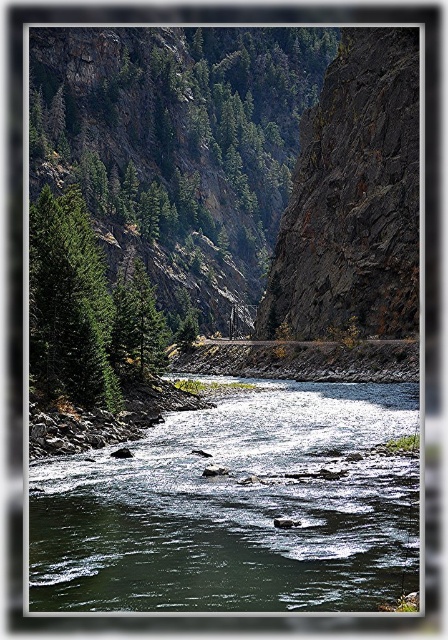
Can you confirm if green smooth water at center is positioned below green matte tree at center-left?

Yes.

Which is more to the right, green smooth water at center or green matte tree at center-left?

From the viewer's perspective, green smooth water at center appears more on the right side.

Find the location of a particular element. The image size is (448, 640). green smooth water at center is located at coordinates point(236,508).

Based on the photo, can you confirm if green matte tree at left is positioned above green matte tree at center-left?

Indeed, green matte tree at left is positioned over green matte tree at center-left.

Does green matte tree at left have a smaller size compared to green matte tree at center-left?

No, green matte tree at left is not smaller than green matte tree at center-left.

Image resolution: width=448 pixels, height=640 pixels. In order to click on green matte tree at left in this screenshot , I will do `click(68, 305)`.

Can you confirm if green smooth water at center is positioned to the left of green matte tree at left?

In fact, green smooth water at center is to the right of green matte tree at left.

Between point (102, 573) and point (52, 326), which one is positioned in front?

Point (102, 573) is more forward.

Find the location of `green smooth water at center`. green smooth water at center is located at coordinates (236, 508).